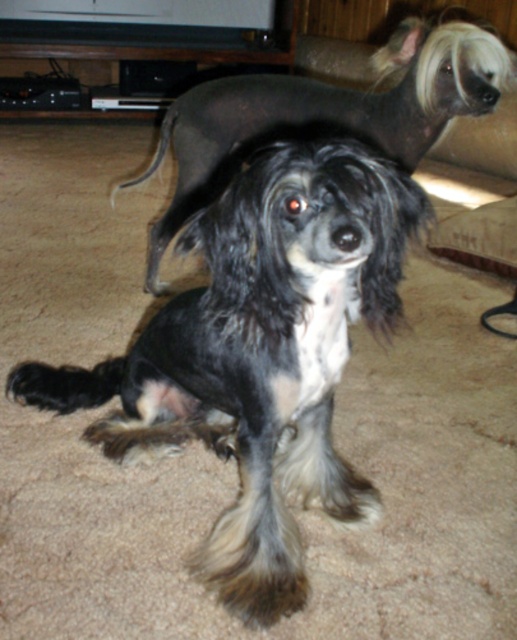
Measure the distance from black silky dog at center to black fur tail at upper center.

black silky dog at center is 49.77 centimeters from black fur tail at upper center.

Is point (229, 160) closer to viewer compared to point (169, 125)?

Yes, it is.

This screenshot has height=640, width=517. Describe the element at coordinates (326, 113) in the screenshot. I see `black silky dog at center` at that location.

The height and width of the screenshot is (640, 517). In order to click on black silky dog at center in this screenshot , I will do `click(326, 113)`.

In the scene shown: Does black and white fur at center have a lesser height compared to black fur tail at upper center?

No.

Can you confirm if black and white fur at center is taller than black fur tail at upper center?

Yes.

Who is more forward, (235, 228) or (143, 177)?

Point (235, 228) is more forward.

Where is `black and white fur at center`? This screenshot has width=517, height=640. black and white fur at center is located at coordinates (260, 353).

Is point (326, 428) less distant than point (190, 152)?

Yes.

Is point (210, 266) positioned behind point (266, 131)?

No, it is not.

Identify the location of black and white fur at center. (260, 353).